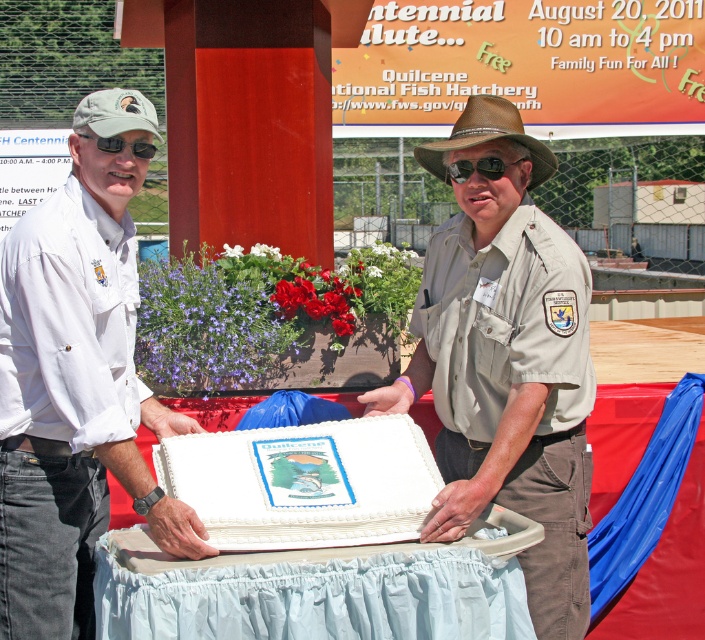
You are at a public event and see the white frosted cake at center and the brown leather cowboy hat at center. Which object is positioned lower?

The white frosted cake at center is positioned lower than the brown leather cowboy hat at center.

You are a photographer at the event and need to position your camera to capture the white plastic tray at center. According to the coordinates provided, where should you aim your camera?

The white plastic tray at center is located at coordinates point (319, 588), so aim your camera there to capture it.

You are at a public event and see a white plastic tray at center and a brown leather cowboy hat at center. Which object is closer to the ground?

The white plastic tray at center is positioned under the brown leather cowboy hat at center, so the white plastic tray at center is closer to the ground.